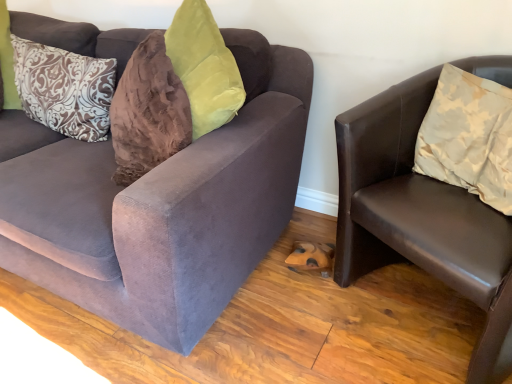
The width and height of the screenshot is (512, 384). I want to click on free space to the left of brown leather chair at right, the first studio couch viewed from the right, so click(298, 328).